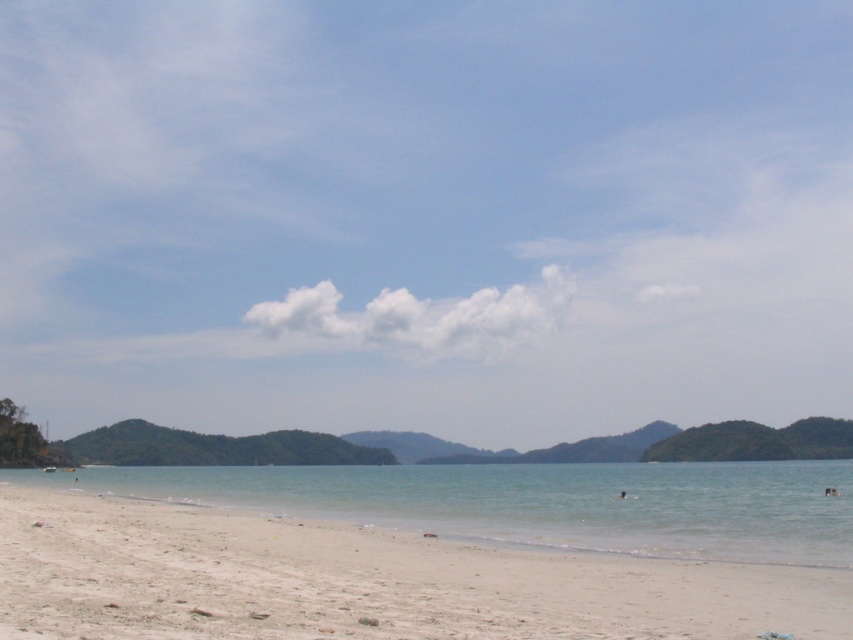
Can you confirm if white sandy beach at lower left is positioned above clear water at beach center?

Indeed, white sandy beach at lower left is positioned over clear water at beach center.

Is point (305, 529) positioned behind point (468, 465)?

No.

Which is in front, point (335, 525) or point (363, 472)?

Positioned in front is point (335, 525).

At what (x,y) coordinates should I click in order to perform the action: click on white sandy beach at lower left. Please return your answer as a coordinate pair (x, y). Image resolution: width=853 pixels, height=640 pixels. Looking at the image, I should click on (363, 580).

Who is more forward, (824, 604) or (624, 492)?

Positioned in front is point (824, 604).

What do you see at coordinates (363, 580) in the screenshot? Image resolution: width=853 pixels, height=640 pixels. I see `white sandy beach at lower left` at bounding box center [363, 580].

Who is more distant from viewer, (100, 595) or (621, 493)?

The point (621, 493) is behind.

At what (x,y) coordinates should I click in order to perform the action: click on white sandy beach at lower left. Please return your answer as a coordinate pair (x, y). The width and height of the screenshot is (853, 640). Looking at the image, I should click on (363, 580).

In the scene shown: Who is higher up, clear water at beach center or brown skin at lower center?

Positioned higher is brown skin at lower center.

Which is more to the right, clear water at beach center or brown skin at lower center?

clear water at beach center

Is point (672, 554) farther from viewer compared to point (624, 497)?

No, it is not.

I want to click on clear water at beach center, so click(535, 502).